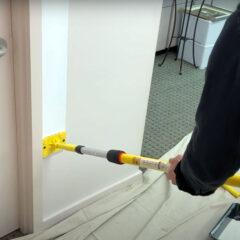
Identify the location of empty space next to ch air. (168, 102).